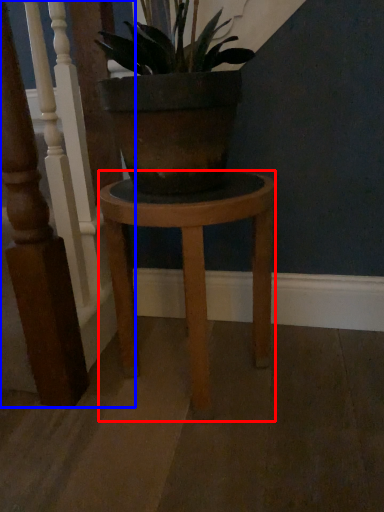
Question: Which point is further to the camera, stool (highlighted by a red box) or rail (highlighted by a blue box)?

Choices:
 (A) stool
 (B) rail

Answer: (A)